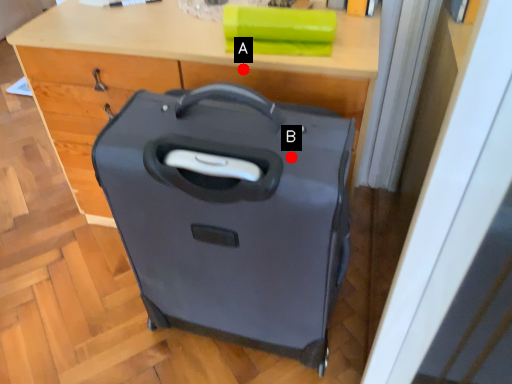
Question: Two points are circled on the image, labeled by A and B beside each circle. Which point is closer to the camera taking this photo?

Choices:
 (A) A is closer
 (B) B is closer

Answer: (B)